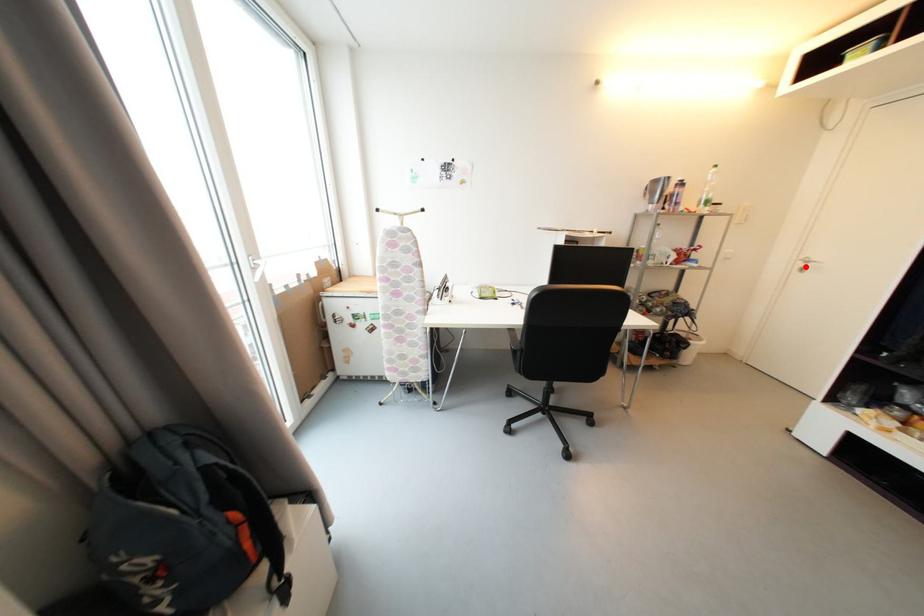
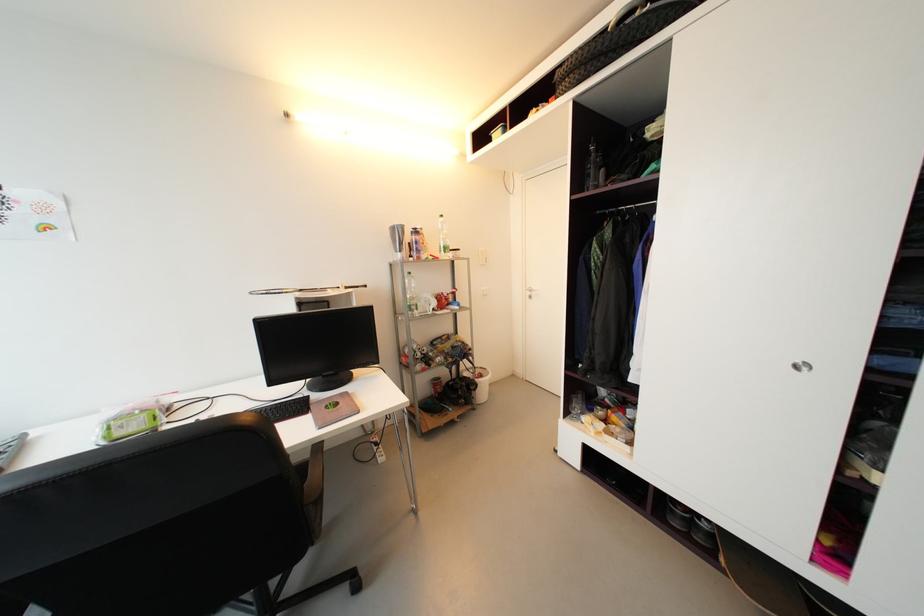
Find the pixel in the second image that matches the highlighted location in the first image.

(533, 294)